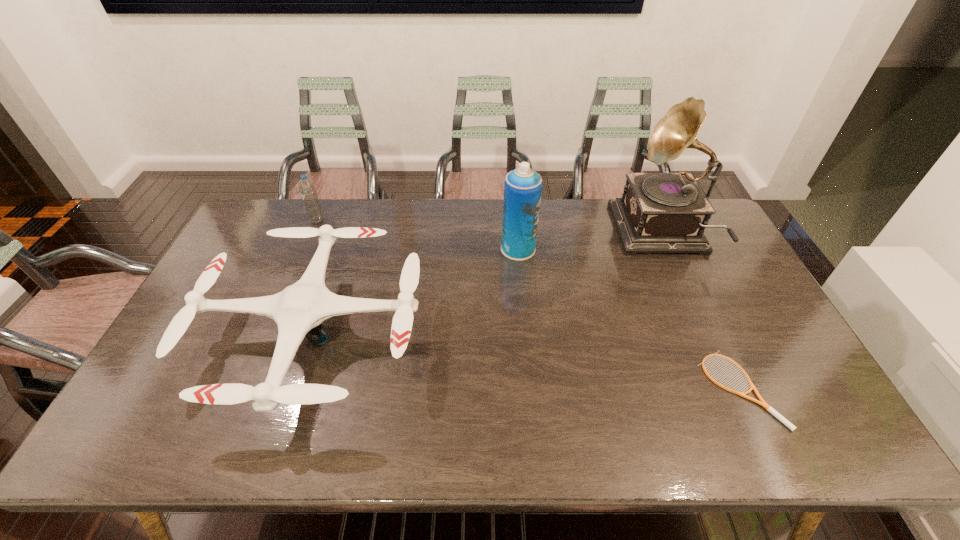
Image resolution: width=960 pixels, height=540 pixels. I want to click on vacant point that satisfies the following two spatial constraints: 1. on the front side of the water bottle; 2. on the left side of the fourth shortest object, so click(305, 249).

At what (x,y) coordinates should I click in order to perform the action: click on vacant space that satisfies the following two spatial constraints: 1. with the camera attached at the bottom of the tennis racket; 2. on the left side of the drone. Please return your answer as a coordinate pair (x, y). The width and height of the screenshot is (960, 540). Looking at the image, I should click on (295, 389).

This screenshot has height=540, width=960. What are the coordinates of `vacant area that satisfies the following two spatial constraints: 1. on the horn of the tallest object; 2. on the back side of the shortest object` in the screenshot? It's located at (732, 389).

At what (x,y) coordinates should I click in order to perform the action: click on vacant region that satisfies the following two spatial constraints: 1. on the horn of the tennis racket; 2. on the right side of the record player. Please return your answer as a coordinate pair (x, y). Looking at the image, I should click on (732, 389).